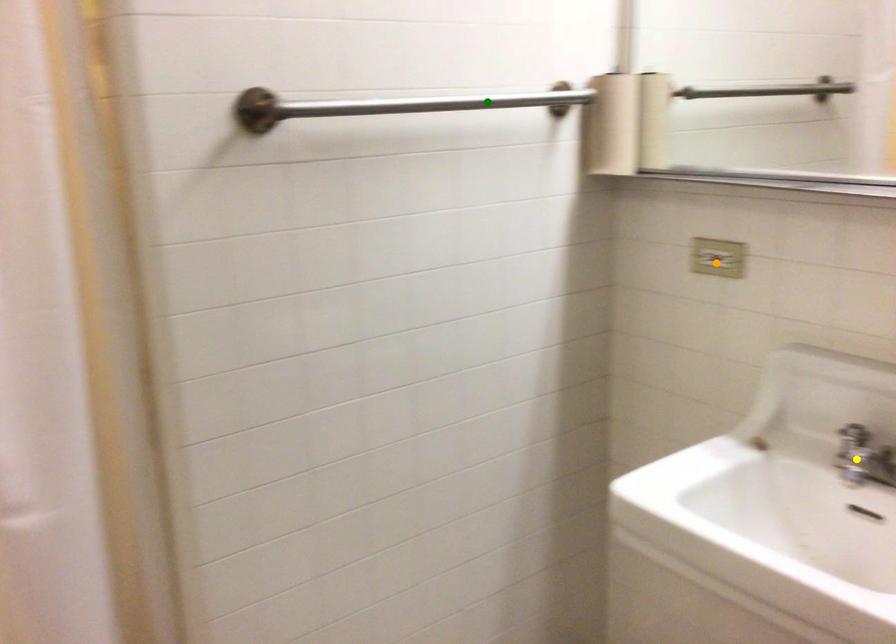
Order these from farthest to nearest:
green point | orange point | yellow point

Answer: green point → orange point → yellow point